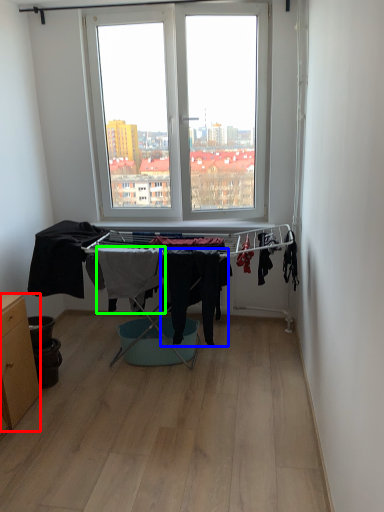
Question: Considering the real-world distances, which object is farthest from table (highlighted by a red box)? clothing (highlighted by a blue box) or clothing (highlighted by a green box)?

Choices:
 (A) clothing
 (B) clothing

Answer: (A)